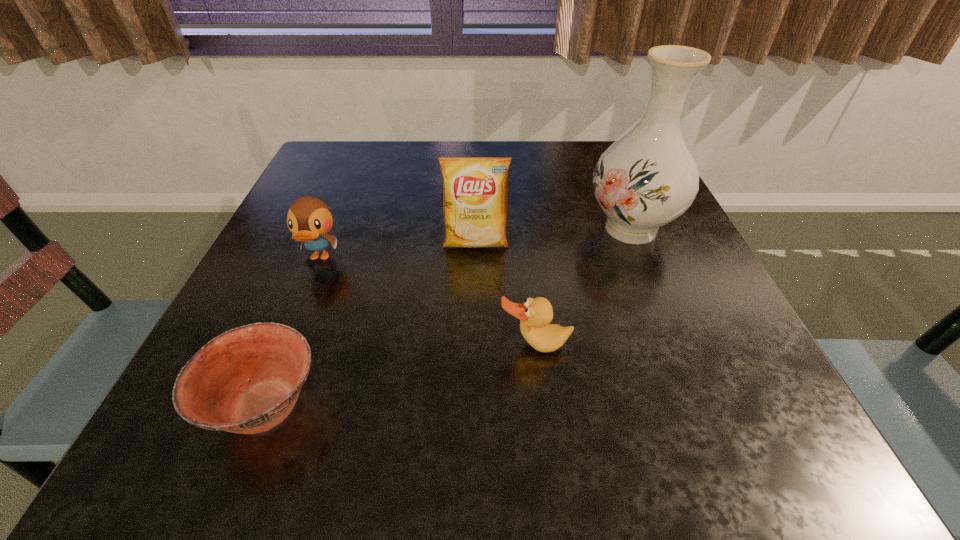
In order to click on vase in this screenshot , I will do `click(646, 179)`.

Where is `the rightmost object`? This screenshot has height=540, width=960. the rightmost object is located at coordinates (646, 179).

Locate an element on the screen. Image resolution: width=960 pixels, height=540 pixels. crisp (potato chip) is located at coordinates (474, 189).

The width and height of the screenshot is (960, 540). What are the coordinates of `the third tallest object` in the screenshot? It's located at (309, 219).

You are a GUI agent. You are given a task and a screenshot of the screen. Output one action in this format:
    pyautogui.click(x=<x>, y=<y>)
    Task: Click on the farther duck
    The image size is (960, 540).
    Given the screenshot: What is the action you would take?
    pyautogui.click(x=309, y=219)

Where is `the second nearest object`? the second nearest object is located at coordinates (535, 314).

Locate an element on the screen. This screenshot has height=540, width=960. the nearer duck is located at coordinates (535, 314).

Identify the location of bowl. (247, 380).

Identify the location of free spot located 0.210m on the front of the vase. The image size is (960, 540). (680, 348).

The width and height of the screenshot is (960, 540). In order to click on vacant position located 0.260m on the front-facing side of the crisp (potato chip) in this screenshot , I will do `click(474, 370)`.